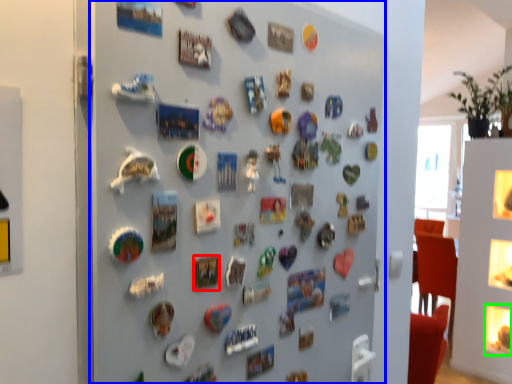
Question: Which is farther away from button (highlighted by a red box)? fireplace (highlighted by a blue box) or button (highlighted by a green box)?

Choices:
 (A) fireplace
 (B) button

Answer: (B)